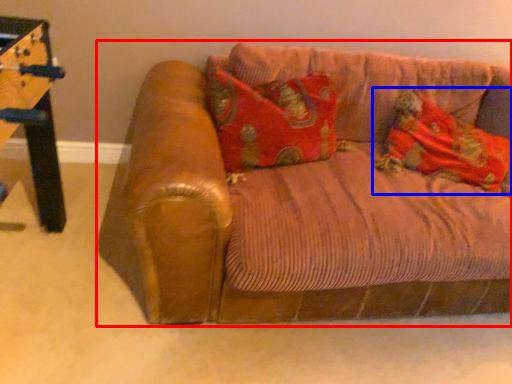
Question: Which of the following is the closest to the observer, studio couch (highlighted by a red box) or material (highlighted by a blue box)?

Choices:
 (A) studio couch
 (B) material

Answer: (A)